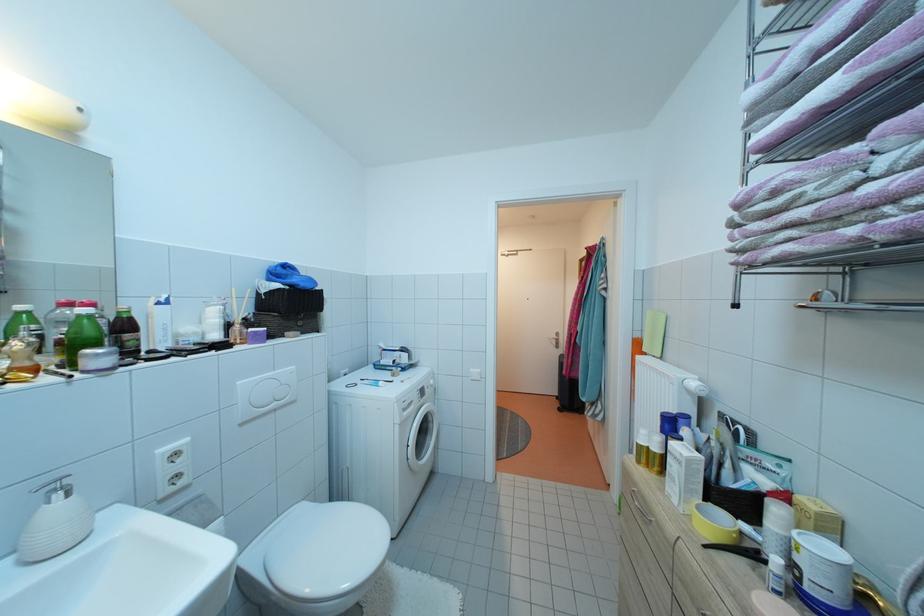
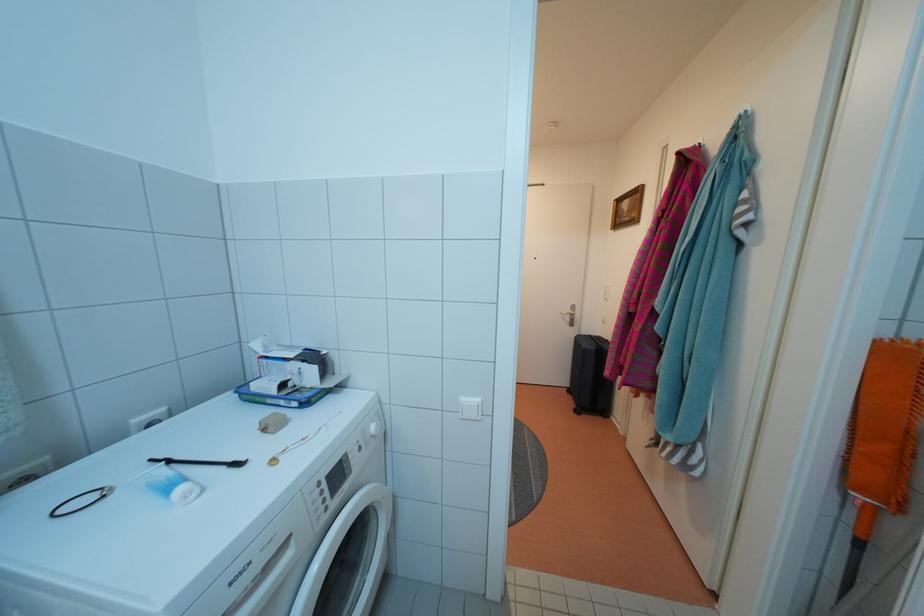
Where in the second image is the point corresponding to the point at 602,252 from the first image?

(704, 153)